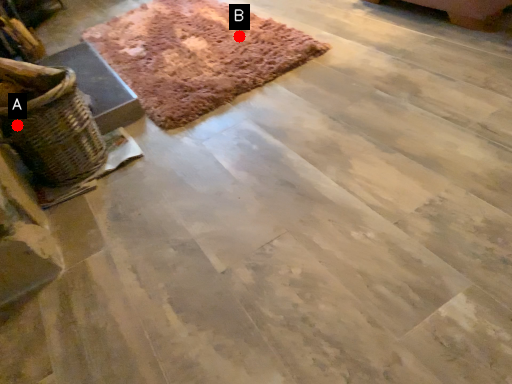
Question: Two points are circled on the image, labeled by A and B beside each circle. Which point appears closest to the camera in this image?

Choices:
 (A) A is closer
 (B) B is closer

Answer: (A)